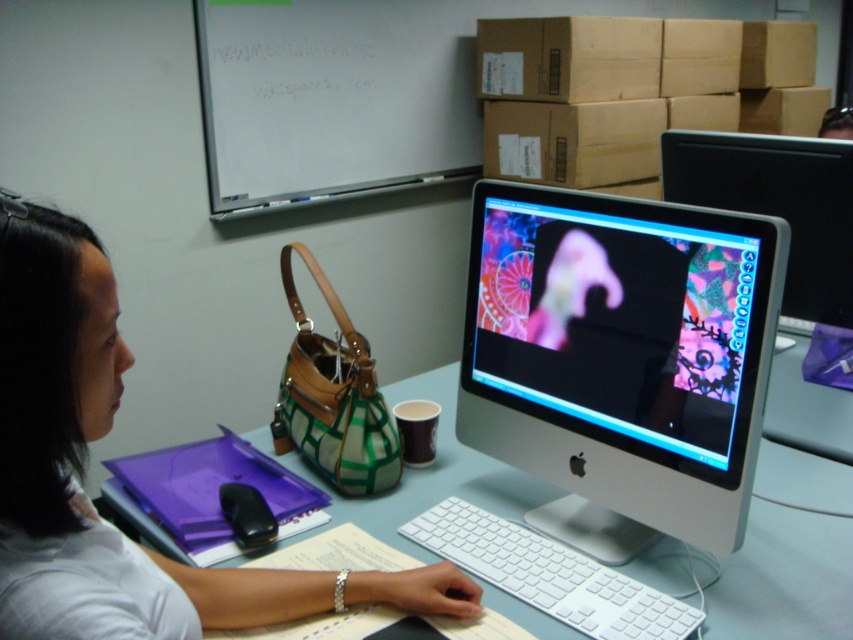
Question: Does white plastic computer desk at center have a smaller size compared to matte plastic monitor at upper right?

Choices:
 (A) no
 (B) yes

Answer: (A)

Question: Among these objects, which one is farthest from the camera?

Choices:
 (A) white plastic keyboard at center
 (B) whiteboard at upper center
 (C) matte plastic monitor at upper right
 (D) black plastic mouse at lower center

Answer: (B)

Question: Does sleek silver monitor at center come behind white fabric shirt at center?

Choices:
 (A) no
 (B) yes

Answer: (B)

Question: Among these objects, which one is nearest to the camera?

Choices:
 (A) matte plastic monitor at upper right
 (B) sleek silver monitor at center
 (C) black plastic mouse at lower center
 (D) whiteboard at upper center

Answer: (B)

Question: Which object is the closest to the white plastic computer desk at center?

Choices:
 (A) whiteboard at upper center
 (B) sleek silver monitor at center
 (C) white plastic keyboard at center

Answer: (C)

Question: Does white fabric shirt at center have a lesser width compared to black plastic mouse at lower center?

Choices:
 (A) yes
 (B) no

Answer: (B)